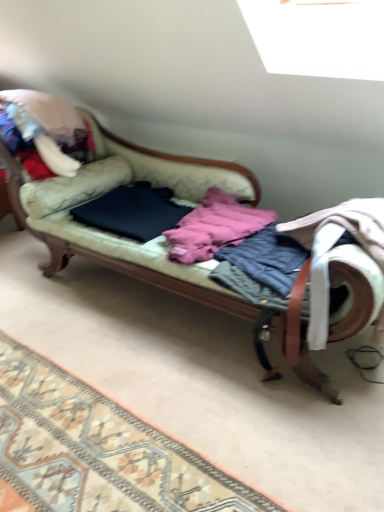
This screenshot has height=512, width=384. I want to click on free space between velvet green couch at center and patterned carpet at lower left, so click(155, 369).